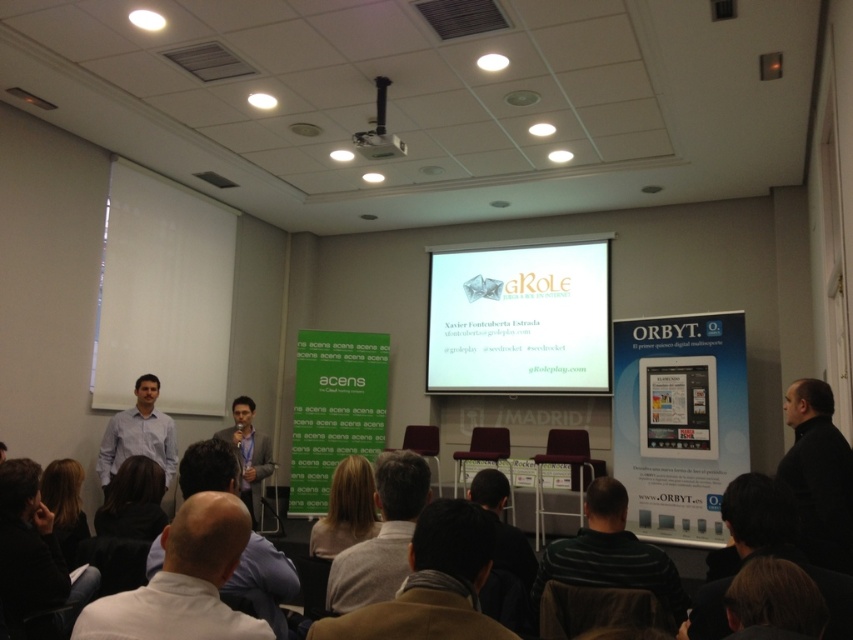
Question: Does matte white shirt at left appear under dark brown hair at lower center?

Choices:
 (A) no
 (B) yes

Answer: (B)

Question: Which is nearer to the white plastic projector at upper center?

Choices:
 (A) striped sweater at center
 (B) dark brown hair at lower left
 (C) blonde hair at center

Answer: (B)

Question: Does white shirt at lower center have a lesser width compared to light brown hair at center?

Choices:
 (A) no
 (B) yes

Answer: (A)

Question: In this image, where is white glossy projection screen at center located relative to white shirt at center?

Choices:
 (A) above
 (B) below

Answer: (A)

Question: Which of the following is the closest to the observer?

Choices:
 (A) blonde hair at center
 (B) white plastic projector at upper center
 (C) white glossy projection screen at center
 (D) light brown leather jacket at center

Answer: (A)

Question: Which of the following is the closest to the observer?

Choices:
 (A) black matte jacket at right
 (B) striped sweater at center
 (C) dark brown hair at lower left
 (D) white shirt at lower center

Answer: (D)